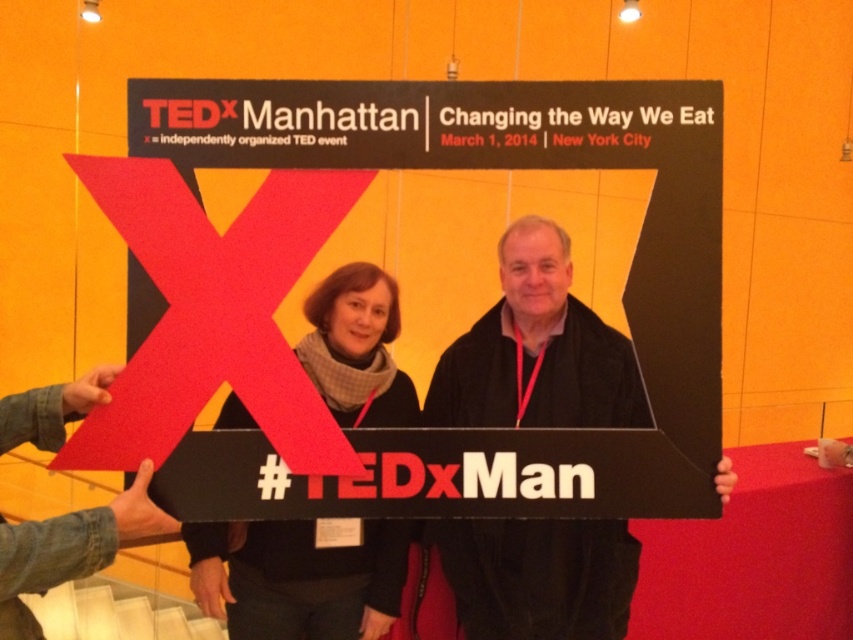
You are organizing a photo shoot and need to ensure that the black matte sign at center and the matte black scarf at center fit within a 1.5 meter wide frame. Given their widths, will both items fit side by side horizontally?

The black matte sign at center is wider than the matte black scarf at center. Since the combined width of both items would exceed the 1.5 meter frame, they cannot fit side by side horizontally.

You are a photographer trying to capture the black matte sign at center and the matte black scarf at center in the same frame. Based on their positions, which object is located to the left of the other?

The matte black scarf at center is located to the left of the black matte sign at center because the black matte sign at center is positioned on the right side of the matte black scarf at center.

You are a photographer standing 10 feet away from the black matte sign at center. You want to take a closeup photo of the sign. If your camera has a focal length of 50mm, what is the minimum distance you need to move closer to the sign to fill the frame?

The black matte sign at center is currently 5.12 feet away from the camera. To take a closeup photo with a 50mm focal length, you need to move closer so that the distance is half of the current distance, which would be approximately 2.56 feet from the sign.